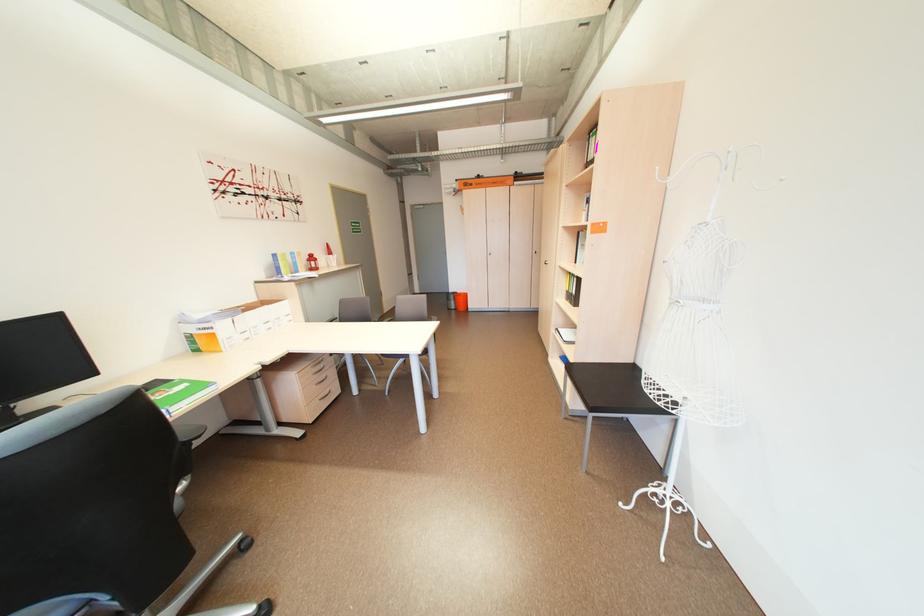
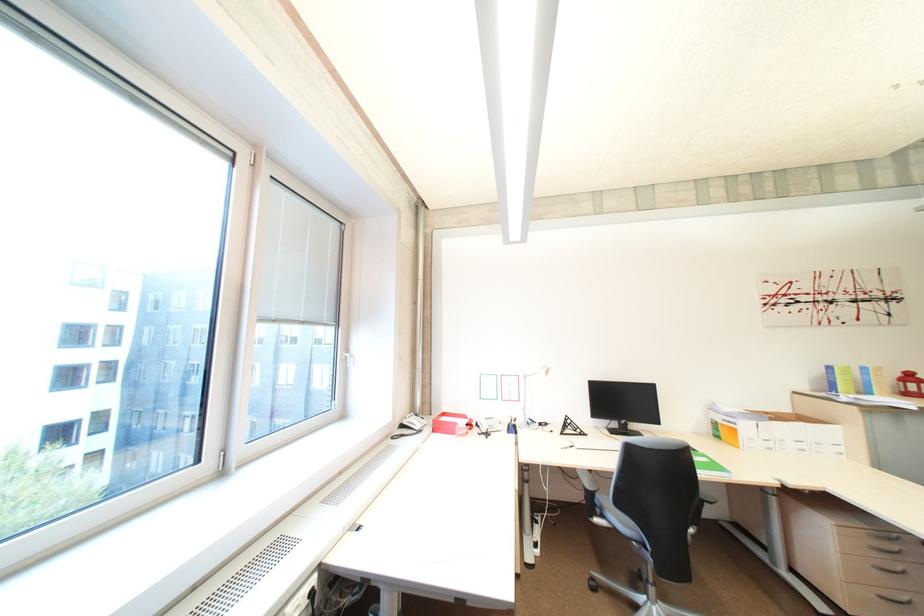
The point at (319, 261) is marked in the first image. Where is the corresponding point in the second image?

(913, 382)